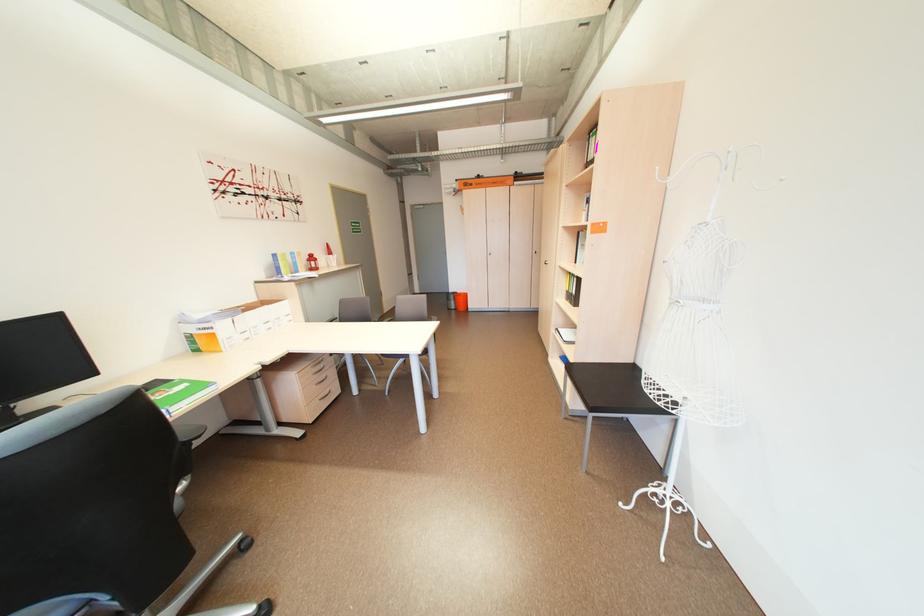
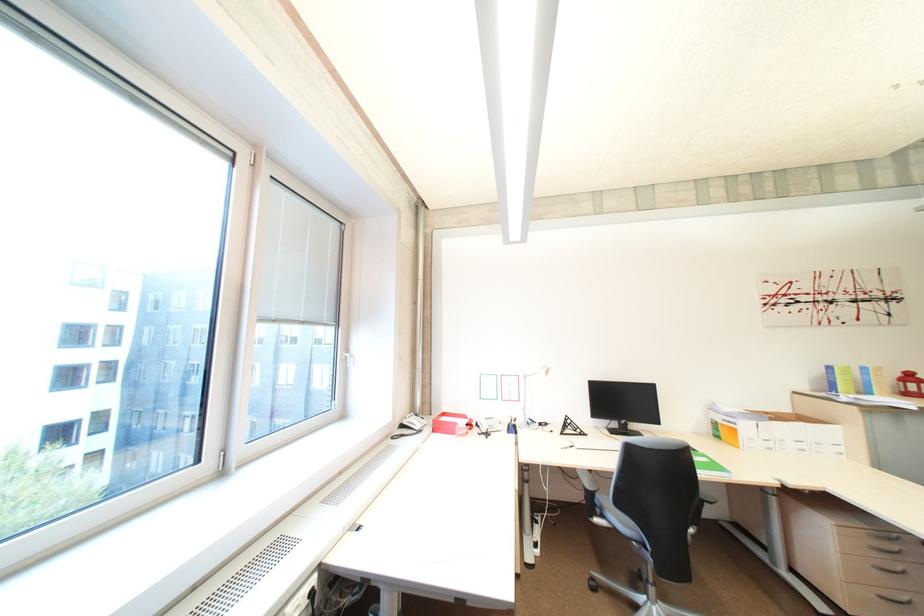
The point at (319, 261) is marked in the first image. Where is the corresponding point in the second image?

(913, 382)